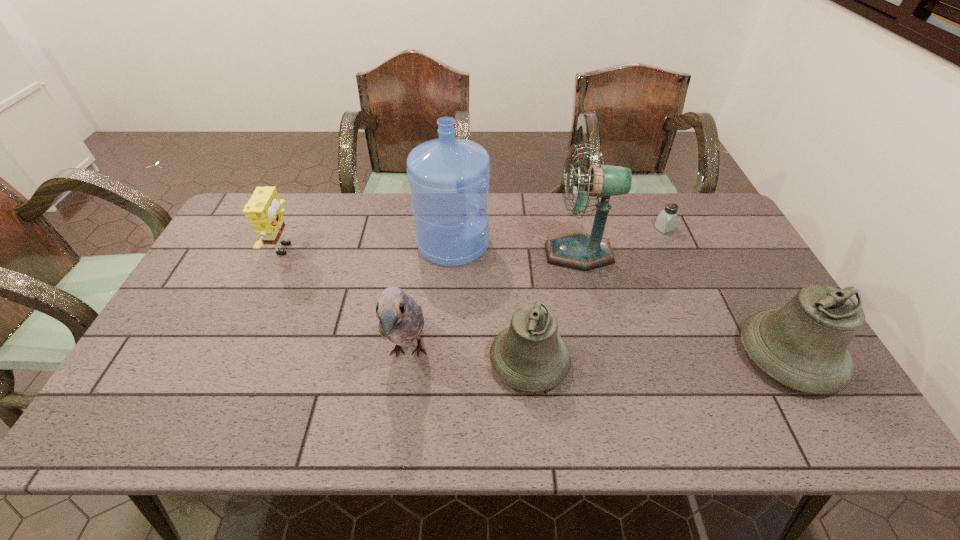
Locate an element on the screen. This screenshot has height=540, width=960. free point located on the back of the right bell is located at coordinates (730, 252).

You are a GUI agent. You are given a task and a screenshot of the screen. Output one action in this format:
    pyautogui.click(x=<x>, y=<y>)
    Task: Click on the free space located 0.170m on the left of the sixth object from left to right
    This screenshot has height=540, width=960.
    Given the screenshot: What is the action you would take?
    pyautogui.click(x=604, y=228)

The width and height of the screenshot is (960, 540). I want to click on vacant area situated 0.310m on the side of the water jug with the handle, so click(587, 244).

You are a GUI agent. You are given a task and a screenshot of the screen. Output one action in this format:
    pyautogui.click(x=<x>, y=<y>)
    Task: Click on the vacant space located on the front-facing side of the sponge
    This screenshot has width=960, height=540.
    Given the screenshot: What is the action you would take?
    pyautogui.click(x=335, y=249)

This screenshot has width=960, height=540. Identify the location of free spot located in front of the fan where the wind blows. (456, 254).

Where is `vacant position located 0.210m in front of the fan where the wind blows`? The image size is (960, 540). vacant position located 0.210m in front of the fan where the wind blows is located at coordinates (478, 254).

Identify the location of vacant space located 0.160m in front of the fan where the wind blows. The height and width of the screenshot is (540, 960). (494, 254).

At what (x,y) coordinates should I click in order to perform the action: click on saltshaker present at the far edge. Please return your answer as a coordinate pair (x, y). The height and width of the screenshot is (540, 960). Looking at the image, I should click on (666, 221).

What are the coordinates of `water jug situated at the far edge` in the screenshot? It's located at [x=449, y=178].

Locate an element on the screen. This screenshot has width=960, height=540. sponge that is at the far edge is located at coordinates (263, 210).